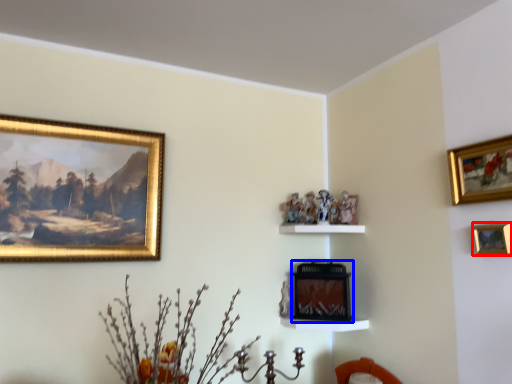
Question: Which object appears closest to the camera in this image, picture frame (highlighted by a red box) or picture frame (highlighted by a blue box)?

Choices:
 (A) picture frame
 (B) picture frame

Answer: (A)